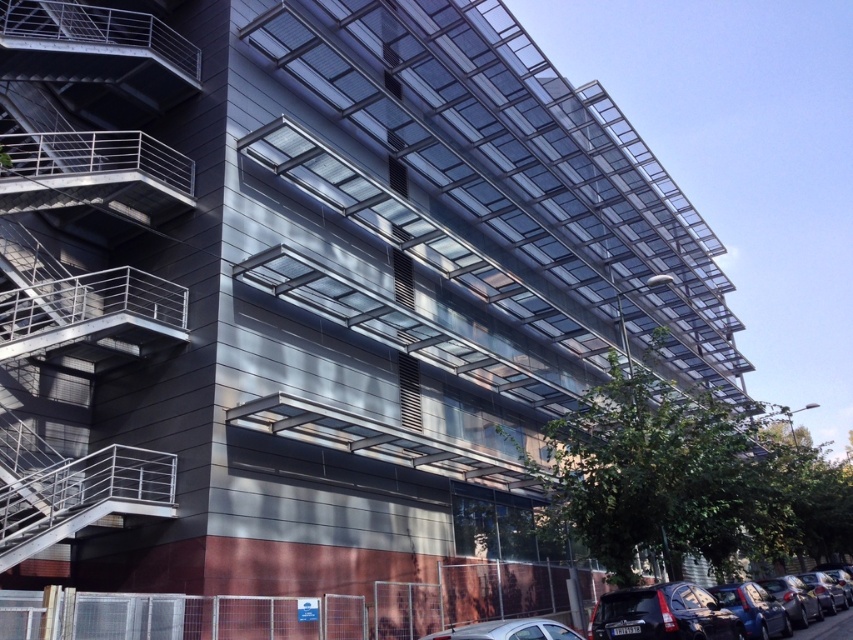
Describe the element at coordinates (793, 598) in the screenshot. I see `shiny black car at lower right` at that location.

Which of these two, shiny black car at lower right or matte black car at lower right, stands shorter?

Standing shorter between the two is shiny black car at lower right.

Which is behind, point (804, 612) or point (795, 637)?

Positioned behind is point (804, 612).

Identify the location of shiny black car at lower right. The image size is (853, 640). (793, 598).

In the scene shown: Can you confirm if metallic silver fire escape at left is positioned to the right of shiny black car at lower right?

Incorrect, metallic silver fire escape at left is not on the right side of shiny black car at lower right.

Which is in front, point (32, 390) or point (808, 609)?

Point (32, 390) is in front.

Identify the location of metallic silver fire escape at left. The height and width of the screenshot is (640, 853). (80, 257).

Describe the element at coordinates (753, 609) in the screenshot. This screenshot has width=853, height=640. I see `metallic blue car at lower right` at that location.

Is metallic blue car at lower right shorter than shiny black car at lower right?

Yes.

Is point (776, 632) closer to camera compared to point (809, 605)?

That is True.

The width and height of the screenshot is (853, 640). What are the coordinates of `metallic blue car at lower right` in the screenshot? It's located at (753, 609).